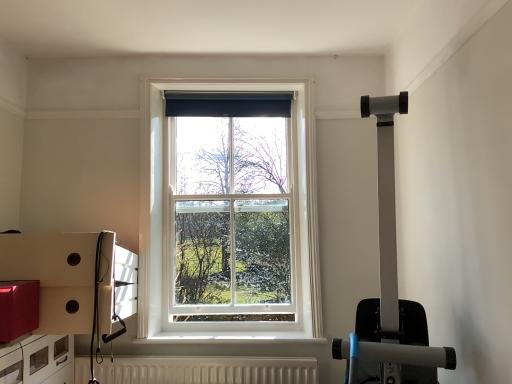
Question: Considering the relative sizes of white wooden window at center and white textured radiator at lower center in the image provided, is white wooden window at center shorter than white textured radiator at lower center?

Choices:
 (A) yes
 (B) no

Answer: (B)

Question: Considering the relative sizes of white wooden window at center and white textured radiator at lower center in the image provided, is white wooden window at center taller than white textured radiator at lower center?

Choices:
 (A) yes
 (B) no

Answer: (A)

Question: Is white wooden window at center wider than white textured radiator at lower center?

Choices:
 (A) yes
 (B) no

Answer: (B)

Question: Does white wooden window at center appear on the left side of white textured radiator at lower center?

Choices:
 (A) no
 (B) yes

Answer: (A)

Question: Does white wooden window at center have a smaller size compared to white textured radiator at lower center?

Choices:
 (A) yes
 (B) no

Answer: (B)

Question: Is white wooden window at center located outside white textured radiator at lower center?

Choices:
 (A) yes
 (B) no

Answer: (A)

Question: From the image's perspective, does matte white drawer at lower left appear higher than white textured radiator at lower center?

Choices:
 (A) yes
 (B) no

Answer: (A)

Question: Would you consider matte white drawer at lower left to be distant from white textured radiator at lower center?

Choices:
 (A) no
 (B) yes

Answer: (A)

Question: From a real-world perspective, is matte white drawer at lower left on top of white textured radiator at lower center?

Choices:
 (A) no
 (B) yes

Answer: (B)

Question: Does matte white drawer at lower left have a greater height compared to white textured radiator at lower center?

Choices:
 (A) yes
 (B) no

Answer: (A)

Question: Is matte white drawer at lower left outside white textured radiator at lower center?

Choices:
 (A) yes
 (B) no

Answer: (A)

Question: Is matte white drawer at lower left looking in the opposite direction of white textured radiator at lower center?

Choices:
 (A) yes
 (B) no

Answer: (B)

Question: From the image's perspective, is white textured radiator at lower center located above matte white drawer at lower left?

Choices:
 (A) yes
 (B) no

Answer: (B)